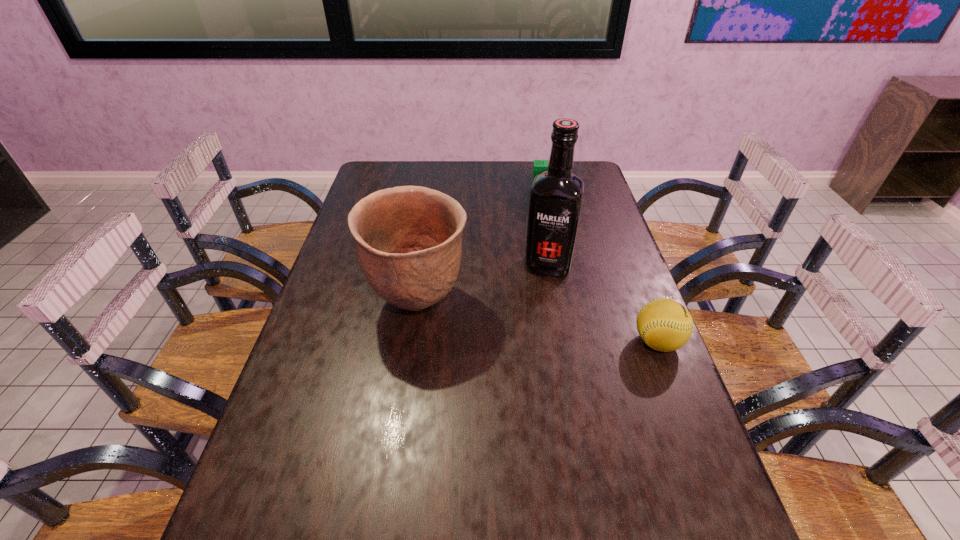
Where is `free spot on the desktop that is between the leftmost object and the softball and is positioned on the front-facing side of the farthest object`? The width and height of the screenshot is (960, 540). free spot on the desktop that is between the leftmost object and the softball and is positioned on the front-facing side of the farthest object is located at coordinates (567, 327).

You are a GUI agent. You are given a task and a screenshot of the screen. Output one action in this format:
    pyautogui.click(x=<x>, y=<y>)
    Task: Click on the vacant space on the desktop that is between the pottery and the softball and is positioned on the front-facing side of the liquor
    This screenshot has height=540, width=960.
    Given the screenshot: What is the action you would take?
    pyautogui.click(x=538, y=322)